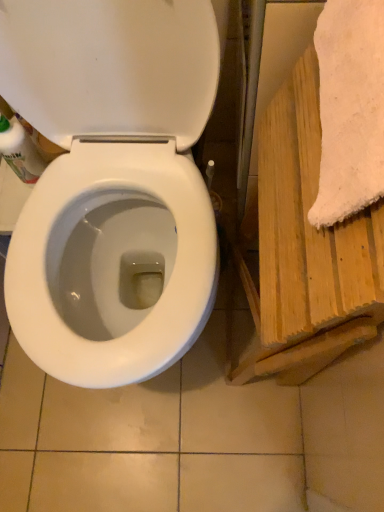
Question: Is white fluffy towel at right situated inside translucent plastic bottle at left or outside?

Choices:
 (A) outside
 (B) inside

Answer: (A)

Question: Is white fluffy towel at right bigger or smaller than translucent plastic bottle at left?

Choices:
 (A) big
 (B) small

Answer: (A)

Question: Estimate the real-world distances between objects in this image. Which object is farther from the translucent plastic bottle at left?

Choices:
 (A) wooden towel at right
 (B) white fluffy towel at right
 (C) white glossy toilet at center

Answer: (A)

Question: Which is farther from the white fluffy towel at right?

Choices:
 (A) wooden towel at right
 (B) white glossy toilet at center
 (C) translucent plastic bottle at left

Answer: (C)